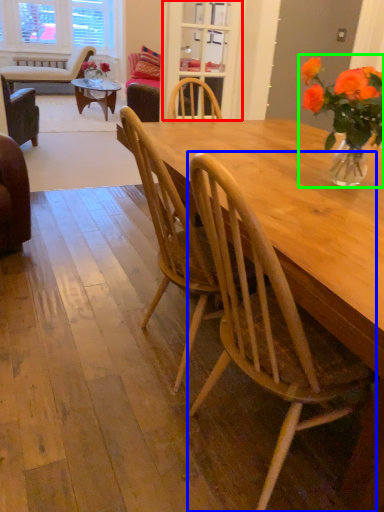
Question: Based on their relative distances, which object is farther from glass door (highlighted by a red box)? Choose from chair (highlighted by a blue box) and floral arrangement (highlighted by a green box).

Choices:
 (A) chair
 (B) floral arrangement

Answer: (A)